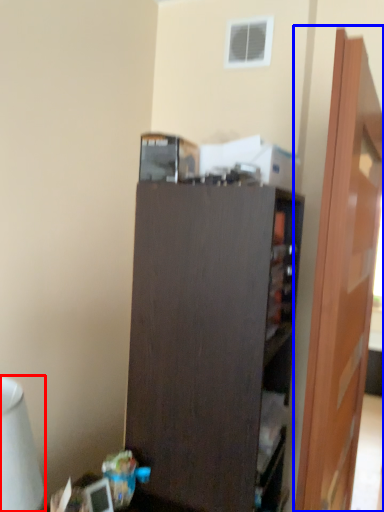
Question: Which object appears closest to the camera in this image, table lamp (highlighted by a red box) or door (highlighted by a blue box)?

Choices:
 (A) table lamp
 (B) door

Answer: (A)